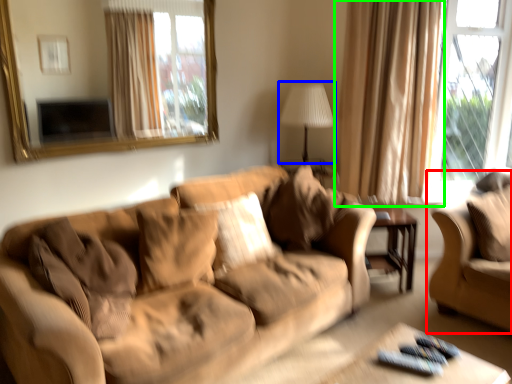
Question: Which object is the farthest from studio couch (highlighted by a red box)? Choose among these: table lamp (highlighted by a blue box) or curtain (highlighted by a green box).

Choices:
 (A) table lamp
 (B) curtain

Answer: (A)